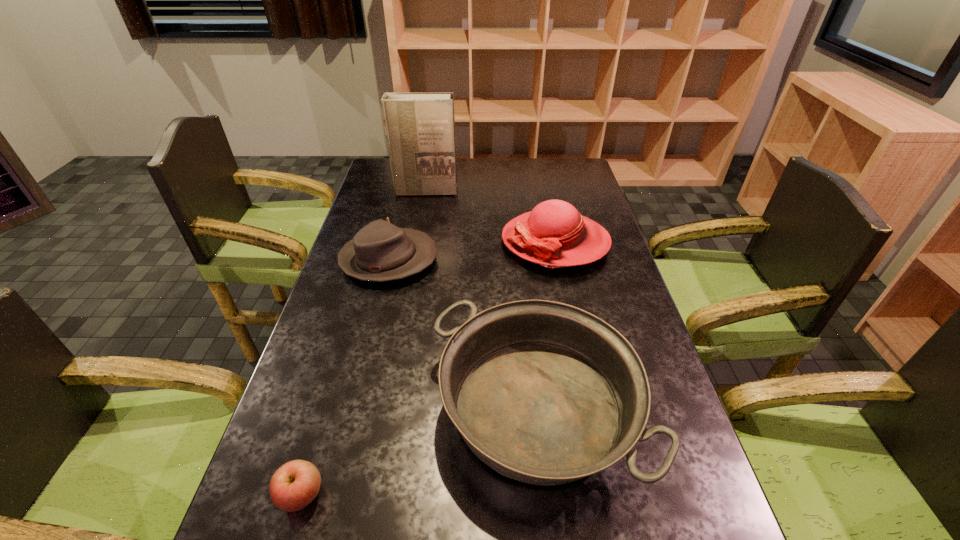
This screenshot has width=960, height=540. What are the coordinates of `vacant space that's between the apple and the tallest object` in the screenshot? It's located at (363, 343).

Select which object appears as the second closest to the tallest object. Please provide its 2D coordinates. Your answer should be formatted as a tuple, i.e. [(x, y)], where the tuple contains the x and y coordinates of a point satisfying the conditions above.

[(380, 251)]

Locate which object is the closest to the apple. Please provide its 2D coordinates. Your answer should be formatted as a tuple, i.e. [(x, y)], where the tuple contains the x and y coordinates of a point satisfying the conditions above.

[(545, 393)]

Find the location of a particular element. free spot that satisfies the following two spatial constraints: 1. at the front of the taller hat with a bow; 2. on the front side of the pan is located at coordinates (591, 409).

Find the location of a particular element. free region that satisfies the following two spatial constraints: 1. on the back side of the pan; 2. on the decorative side of the shorter hat is located at coordinates (520, 260).

This screenshot has height=540, width=960. Identify the location of free point that satisfies the following two spatial constraints: 1. on the cover of the pan; 2. on the right side of the phonebook. (386, 409).

You are a GUI agent. You are given a task and a screenshot of the screen. Output one action in this format:
    pyautogui.click(x=<x>, y=<y>)
    Task: Click on the vacant area that satisfies the following two spatial constraints: 1. on the decorative side of the pan; 2. on the right side of the second shortest object
    
    Given the screenshot: What is the action you would take?
    pyautogui.click(x=352, y=409)

I want to click on free space that satisfies the following two spatial constraints: 1. on the back side of the pan; 2. on the decorative side of the shorter hat, so tap(520, 260).

This screenshot has width=960, height=540. What are the coordinates of `vacant space that satisfies the following two spatial constraints: 1. on the cover of the farthest object; 2. on the decorative side of the shorter hat` in the screenshot? It's located at (413, 260).

Identify the location of free spot that satisfies the following two spatial constraints: 1. on the decorative side of the left hat; 2. on the front side of the shortest object. (330, 495).